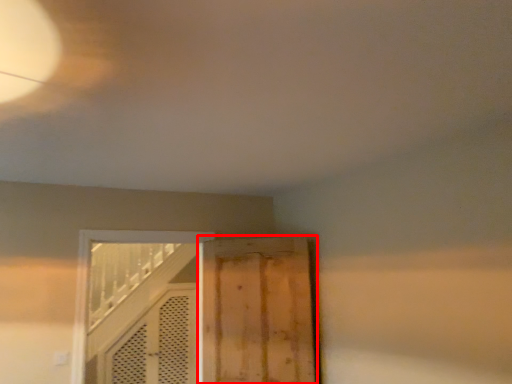
Question: From the image, what is the correct spatial relationship of door (annotated by the red box) in relation to door?

Choices:
 (A) left
 (B) right

Answer: (B)